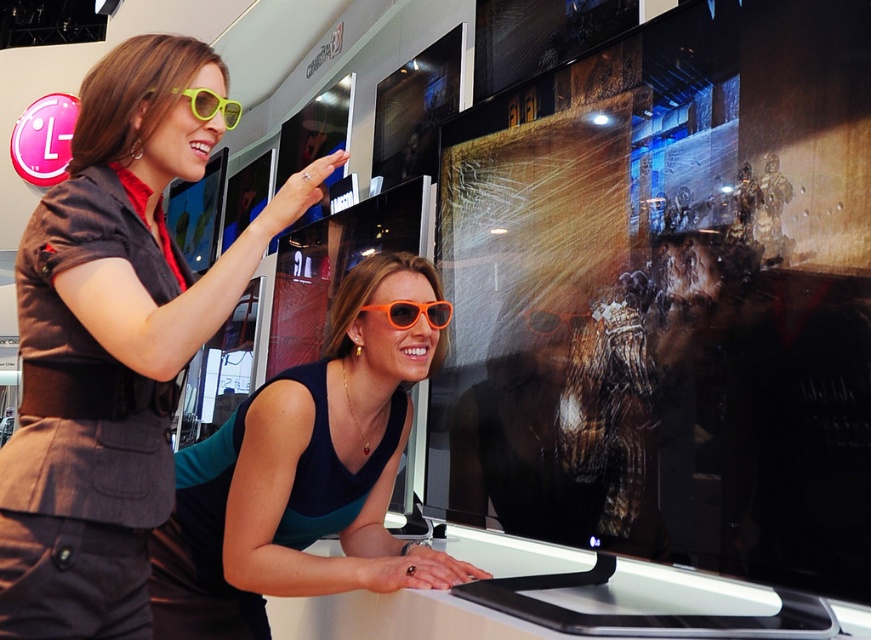
Question: Which object is farther from the camera taking this photo?

Choices:
 (A) orange matte sunglasses at center
 (B) orange plastic sunglasses at center
 (C) matte black jacket at upper left
 (D) yellow matte sunglasses at upper left

Answer: (B)

Question: From the image, what is the correct spatial relationship of orange matte sunglasses at center in relation to orange plastic sunglasses at center?

Choices:
 (A) below
 (B) above

Answer: (A)

Question: Can you confirm if orange plastic sunglasses at center is wider than yellow matte sunglasses at upper left?

Choices:
 (A) no
 (B) yes

Answer: (A)

Question: Which point is farther from the camera taking this photo?

Choices:
 (A) (157, 124)
 (B) (191, 113)
 (C) (429, 308)

Answer: (C)

Question: Considering the relative positions of orange plastic sunglasses at center and yellow matte sunglasses at upper left in the image provided, where is orange plastic sunglasses at center located with respect to yellow matte sunglasses at upper left?

Choices:
 (A) left
 (B) right

Answer: (B)

Question: Based on their relative distances, which object is nearer to the matte black jacket at upper left?

Choices:
 (A) orange matte sunglasses at center
 (B) yellow matte sunglasses at upper left
 (C) orange plastic sunglasses at center

Answer: (B)